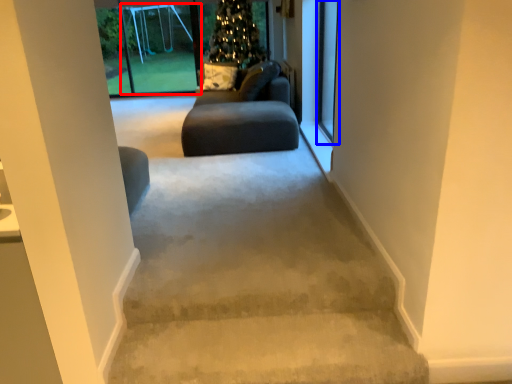
Question: Which of the following is the farthest to the observer, screen door (highlighted by a red box) or screen door (highlighted by a blue box)?

Choices:
 (A) screen door
 (B) screen door

Answer: (A)